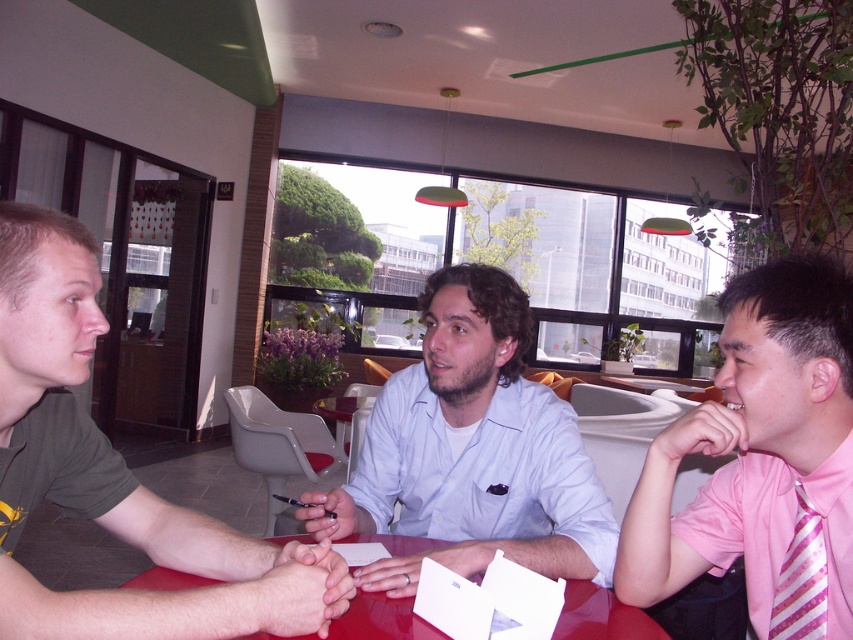
Question: Is light blue shirt at center above pink striped tie at lower right?

Choices:
 (A) yes
 (B) no

Answer: (A)

Question: Does light blue shirt at center come behind smooth glossy table at center?

Choices:
 (A) yes
 (B) no

Answer: (A)

Question: Does pink striped tie at right have a lesser width compared to pink striped tie at lower right?

Choices:
 (A) yes
 (B) no

Answer: (B)

Question: Which of the following is the farthest from the observer?

Choices:
 (A) smooth glossy table at center
 (B) light blue shirt at center
 (C) green matte shirt at left

Answer: (B)

Question: Which point is farther from the camera taking this photo?

Choices:
 (A) (404, 525)
 (B) (79, 508)
 (C) (822, 611)

Answer: (A)

Question: Among these points, which one is farthest from the camera?

Choices:
 (A) (387, 538)
 (B) (19, 483)
 (C) (312, 504)

Answer: (C)